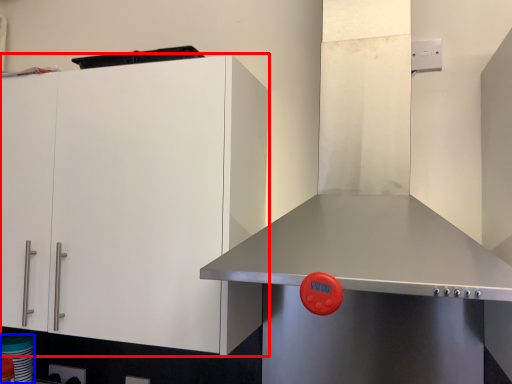
Question: Among these objects, which one is farthest to the camera, cabinetry (highlighted by a red box) or appliance (highlighted by a blue box)?

Choices:
 (A) cabinetry
 (B) appliance

Answer: (B)